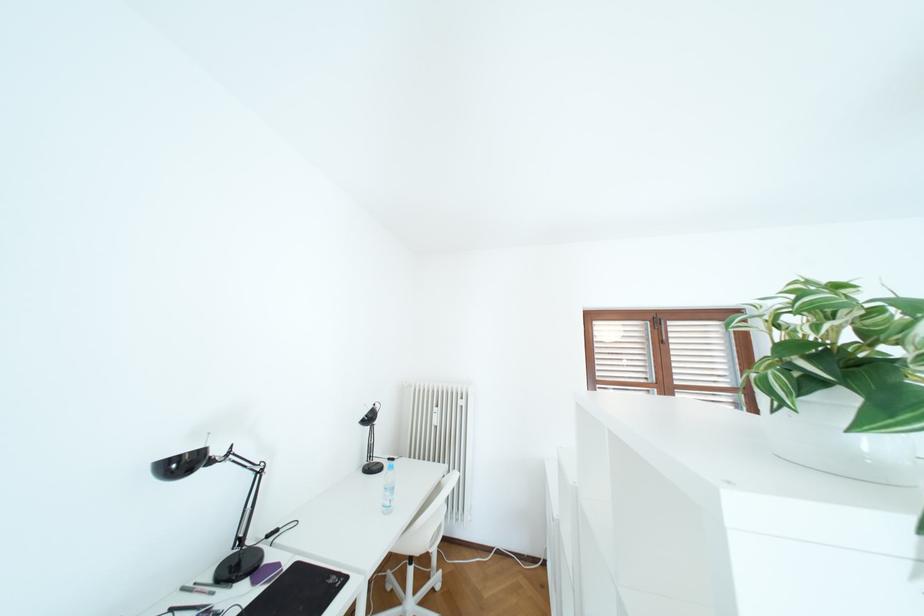
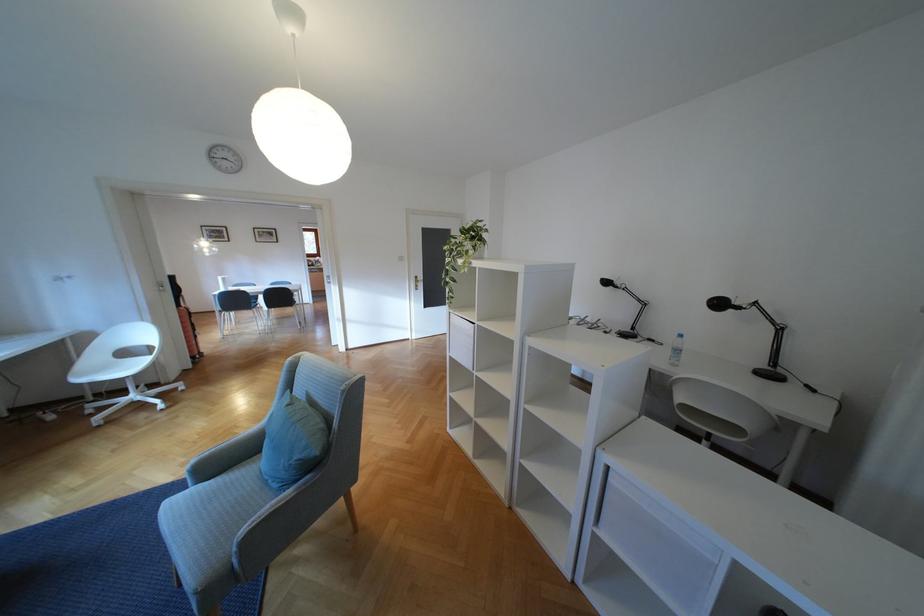
The point at [193,466] is marked in the first image. Where is the corresponding point in the second image?

(616, 284)